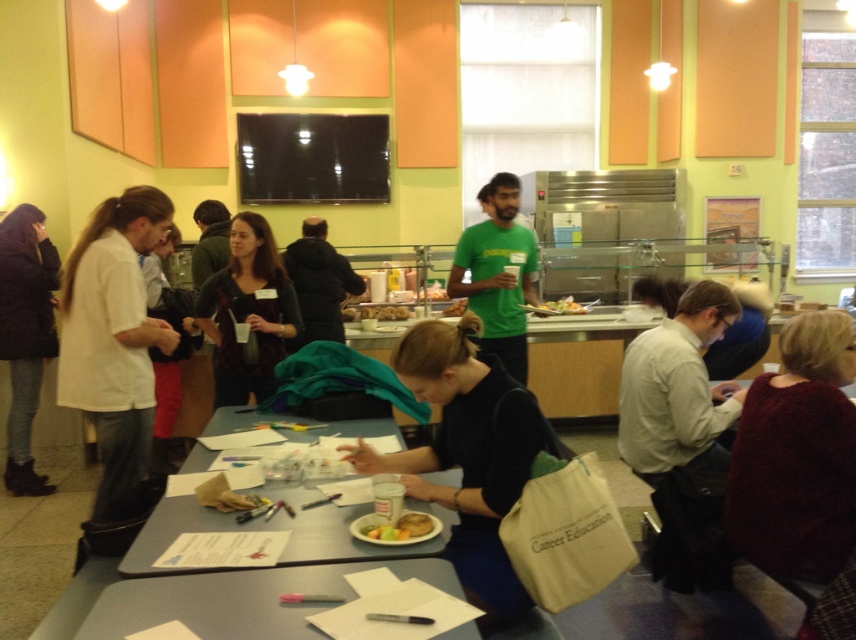
Does green t-shirt at center have a lesser height compared to smooth yellow cake at center?

In fact, green t-shirt at center may be taller than smooth yellow cake at center.

Can you confirm if green t-shirt at center is positioned to the left of smooth yellow cake at center?

Yes, green t-shirt at center is to the left of smooth yellow cake at center.

Which is behind, point (295, 340) or point (377, 516)?

Point (295, 340)

The width and height of the screenshot is (856, 640). I want to click on green t-shirt at center, so click(x=318, y=284).

Does dark brown leather jacket at left appear on the right side of green matte shirt at center?

No, dark brown leather jacket at left is not to the right of green matte shirt at center.

Who is shorter, dark brown leather jacket at left or green matte shirt at center?

With less height is green matte shirt at center.

Identify the location of dark brown leather jacket at left. (25, 333).

Between maroon sweater at lower right and green t-shirt at center, which one appears on the right side from the viewer's perspective?

From the viewer's perspective, maroon sweater at lower right appears more on the right side.

Can you confirm if maroon sweater at lower right is positioned to the left of green t-shirt at center?

Incorrect, maroon sweater at lower right is not on the left side of green t-shirt at center.

This screenshot has width=856, height=640. I want to click on maroon sweater at lower right, so click(x=797, y=456).

Find the location of a particular element. The height and width of the screenshot is (640, 856). maroon sweater at lower right is located at coordinates (797, 456).